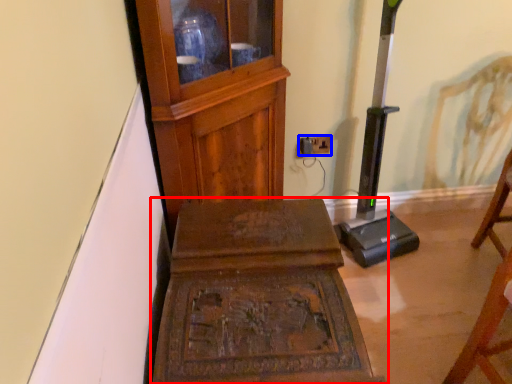
Question: Which point is closer to the camera, furniture (highlighted by a red box) or electric outlet (highlighted by a blue box)?

Choices:
 (A) furniture
 (B) electric outlet

Answer: (A)